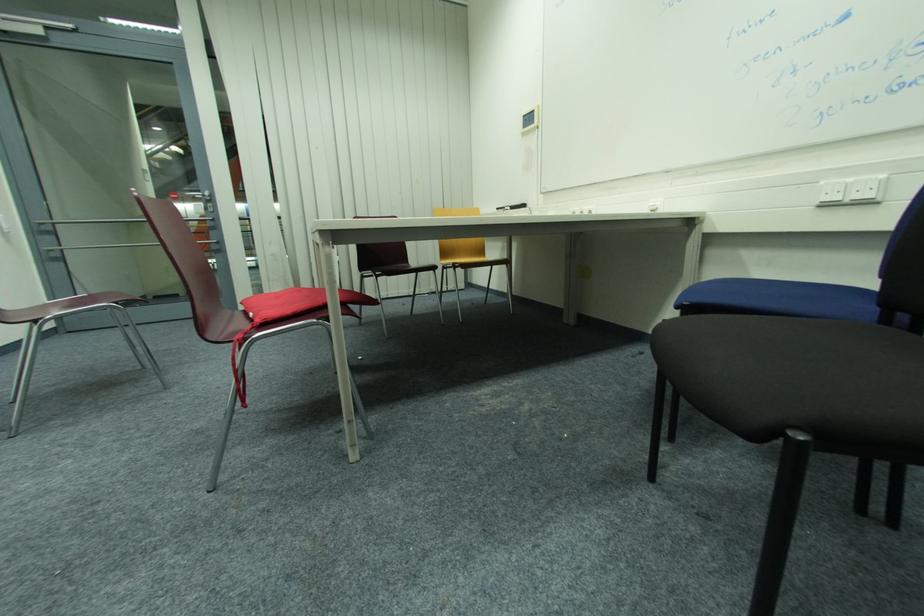
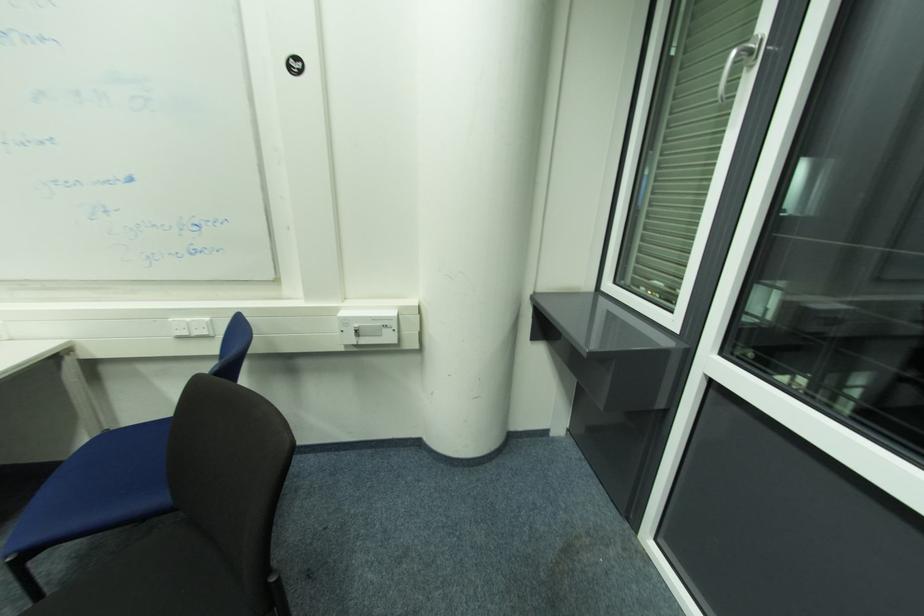
Locate, in the second image, the point that corresponds to (x=855, y=180) in the first image.

(191, 320)